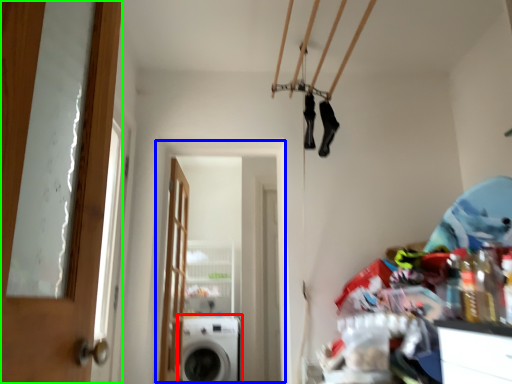
Question: Considering the real-world distances, which object is farthest from washing machine (highlighted by a red box)? screen door (highlighted by a blue box) or door (highlighted by a green box)?

Choices:
 (A) screen door
 (B) door

Answer: (B)